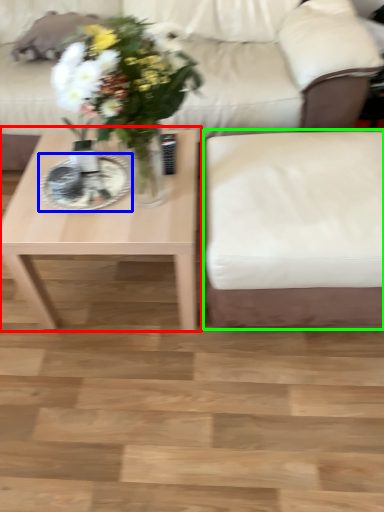
Question: Which object is the closest to the coffee table (highlighted by a red box)? Choose among these: plate (highlighted by a blue box) or armchair (highlighted by a green box).

Choices:
 (A) plate
 (B) armchair

Answer: (A)